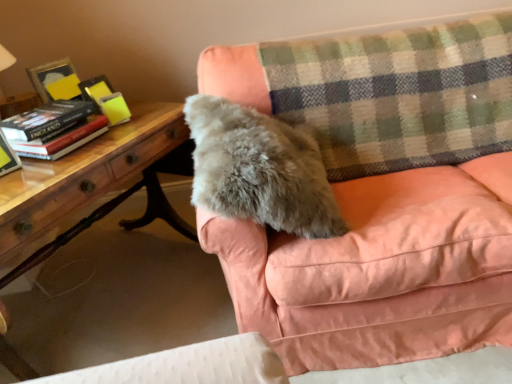
What do you see at coordinates (259, 169) in the screenshot? I see `gray furry pillow at center` at bounding box center [259, 169].

You are a GUI agent. You are given a task and a screenshot of the screen. Output one action in this format:
    pyautogui.click(x=<x>, y=<y>)
    Task: Click on the wooden table at left
    The height and width of the screenshot is (384, 512).
    Given the screenshot: What is the action you would take?
    pyautogui.click(x=98, y=184)

This screenshot has width=512, height=384. What are the coordinates of `soft pink fabric couch at upper right` in the screenshot? It's located at (380, 269).

You are a GUI agent. You are given a task and a screenshot of the screen. Output one action in this format:
    pyautogui.click(x=<x>, y=<y>)
    Task: Click on the hardcover book at left
    This screenshot has height=384, width=512.
    Given the screenshot: What is the action you would take?
    pyautogui.click(x=7, y=157)

What do you see at coordinates (399, 94) in the screenshot? I see `green plaid blanket at upper right` at bounding box center [399, 94].

This screenshot has height=384, width=512. Identify the location of gray furry pillow at center. (259, 169).

Do you think soft pink fabric couch at upper right is within wooden table at left, or outside of it?

soft pink fabric couch at upper right is not inside wooden table at left, it's outside.

Is wooden table at left at the back of soft pink fabric couch at upper right?

No, soft pink fabric couch at upper right is not facing away from wooden table at left.

Looking at the image, does soft pink fabric couch at upper right seem bigger or smaller compared to wooden table at left?

Clearly, soft pink fabric couch at upper right is larger in size than wooden table at left.

Based on the photo, visually, is soft pink fabric couch at upper right positioned to the left or to the right of wooden table at left?

From the image, it's evident that soft pink fabric couch at upper right is to the right of wooden table at left.

From the image's perspective, is green plaid blanket at upper right above hardcover book at left?

Yes.

Looking at this image, is green plaid blanket at upper right aimed at hardcover book at left?

No, green plaid blanket at upper right is not aimed at hardcover book at left.

Is point (321, 45) positioned in front of point (58, 111)?

No, it is not.

Does hardcover book at left have a smaller size compared to hardcover book at left?

Correct, hardcover book at left occupies less space than hardcover book at left.

Considering the positions of objects hardcover book at left and hardcover book at left in the image provided, who is more to the left, hardcover book at left or hardcover book at left?

hardcover book at left.

From a real-world perspective, is hardcover book at left physically below hardcover book at left?

No, from a real-world perspective, hardcover book at left is not below hardcover book at left.

Is hardcover book at left beside hardcover book at left?

hardcover book at left and hardcover book at left are not in contact.

From a real-world perspective, is gray furry pillow at center beneath hardcover book at left?

Indeed, from a real-world perspective, gray furry pillow at center is positioned beneath hardcover book at left.

Is gray furry pillow at center behind hardcover book at left?

No, it is not.

Between point (259, 203) and point (10, 163), which one is positioned in front?

Point (259, 203)

Which of these two, gray furry pillow at center or hardcover book at left, stands shorter?

hardcover book at left.

Considering their positions, is wooden table at left located in front of or behind hardcover book at left?

wooden table at left is in front of hardcover book at left.

Could you tell me if wooden table at left is facing hardcover book at left?

No, wooden table at left is not oriented towards hardcover book at left.

From a real-world perspective, is wooden table at left positioned above or below hardcover book at left?

From a real-world perspective, wooden table at left is physically below hardcover book at left.

In the scene shown: Is hardcover book at left next to gray furry pillow at center?

No, hardcover book at left is not with gray furry pillow at center.

Considering the sizes of objects hardcover book at left and gray furry pillow at center in the image provided, who is bigger, hardcover book at left or gray furry pillow at center?

With larger size is gray furry pillow at center.

How much distance is there between hardcover book at left and gray furry pillow at center?

hardcover book at left is 21.80 inches away from gray furry pillow at center.

Identify the location of book on the left of gray furry pillow at center. This screenshot has width=512, height=384. (75, 126).

Does point (83, 117) lie in front of point (509, 34)?

Yes, point (83, 117) is closer to viewer.

At what (x,y) coordinates should I click in order to perform the action: click on book lying on the left of green plaid blanket at upper right. Please return your answer as a coordinate pair (x, y). Looking at the image, I should click on (75, 126).

From the picture: Between hardcover book at left and green plaid blanket at upper right, which one has less height?

Standing shorter between the two is hardcover book at left.

Is hardcover book at left completely or partially outside of green plaid blanket at upper right?

Yes, hardcover book at left is located beyond the bounds of green plaid blanket at upper right.

This screenshot has height=384, width=512. What are the coordinates of `table to the left of soft pink fabric couch at upper right` in the screenshot? It's located at (98, 184).

Find the location of `book below the green plaid blanket at upper right (from the image's perspective)`. book below the green plaid blanket at upper right (from the image's perspective) is located at coordinates (75, 126).

Considering their positions, is gray furry pillow at center positioned further to wooden table at left than green plaid blanket at upper right?

The object further to wooden table at left is green plaid blanket at upper right.

When comparing their distances from soft pink fabric couch at upper right, does wooden table at left or green plaid blanket at upper right seem closer?

green plaid blanket at upper right is positioned closer to the anchor soft pink fabric couch at upper right.

When comparing their distances from wooden table at left, does gray furry pillow at center or hardcover book at left seem further?

gray furry pillow at center.

Looking at the image, which one is located further to gray furry pillow at center, green plaid blanket at upper right or wooden table at left?

wooden table at left lies further to gray furry pillow at center than the other object.

Looking at the image, which one is located further to soft pink fabric couch at upper right, hardcover book at left or green plaid blanket at upper right?

Among the two, hardcover book at left is located further to soft pink fabric couch at upper right.

Which object lies nearer to the anchor point gray furry pillow at center, hardcover book at left or wooden table at left?

wooden table at left lies closer to gray furry pillow at center than the other object.

Looking at the image, which one is located further to hardcover book at left, wooden table at left or green plaid blanket at upper right?

The object further to hardcover book at left is green plaid blanket at upper right.

Considering their positions, is hardcover book at left positioned closer to soft pink fabric couch at upper right than gray furry pillow at center?

gray furry pillow at center.

The image size is (512, 384). I want to click on throw pillow between hardcover book at left and green plaid blanket at upper right, so click(259, 169).

Image resolution: width=512 pixels, height=384 pixels. Find the location of `studio couch situated between gray furry pillow at center and green plaid blanket at upper right from left to right`. studio couch situated between gray furry pillow at center and green plaid blanket at upper right from left to right is located at coordinates (380, 269).

Identify the location of table between hardcover book at left and green plaid blanket at upper right from left to right. (98, 184).

Image resolution: width=512 pixels, height=384 pixels. Identify the location of throw pillow between wooden table at left and soft pink fabric couch at upper right in the horizontal direction. (259, 169).